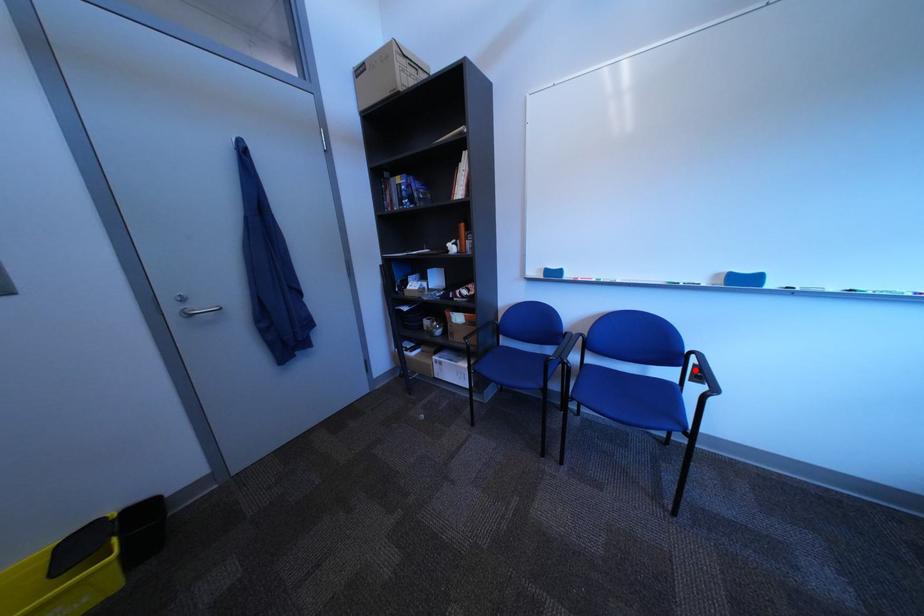
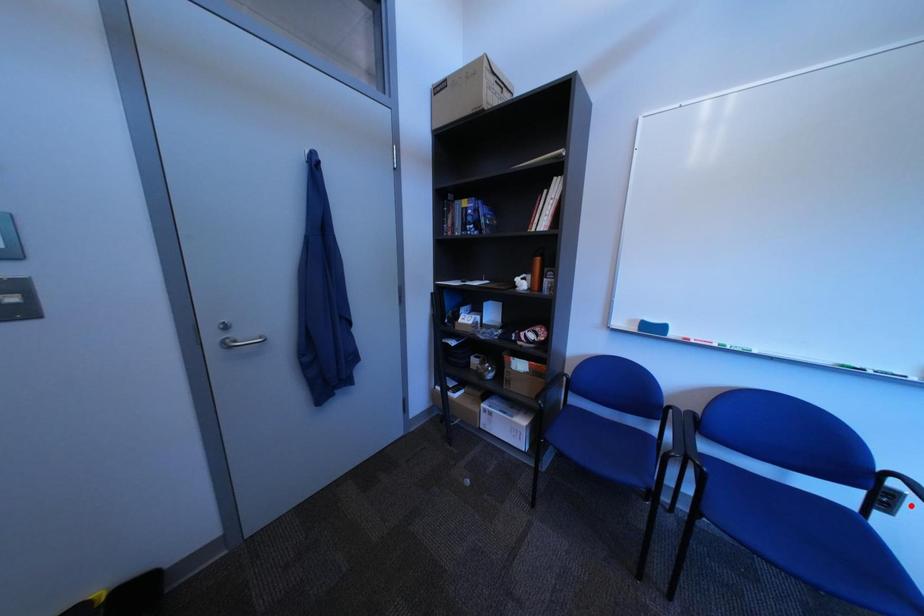
I am providing you with two images of the same scene from different viewpoints. A red point is marked on the first image and another point is marked on the second image. Is the red point in image1 aligned with the point shown in image2?

No